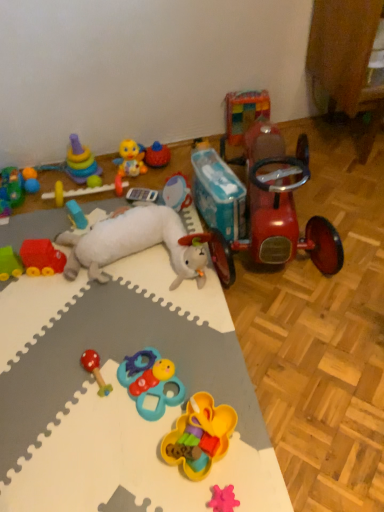
This screenshot has width=384, height=512. I want to click on vacant area that is in front of multicolored plastic rings at upper left, marked as the 2th toy in a left-to-right arrangement, so click(80, 208).